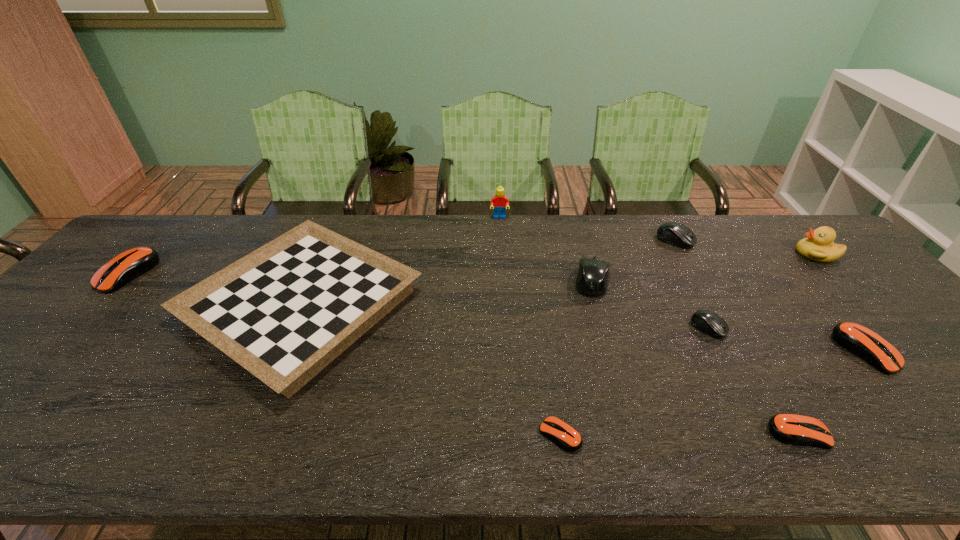
Locate an element on the screen. vacant space at the left edge of the desktop is located at coordinates (18, 408).

Find the location of a particular element. vacant space at the right edge of the desktop is located at coordinates (887, 302).

You are a GUI agent. You are given a task and a screenshot of the screen. Output one action in this format:
    pyautogui.click(x=<x>, y=<y>)
    Task: Click on the vacant space at the far right corner of the desktop
    This screenshot has width=960, height=540.
    Given the screenshot: What is the action you would take?
    pyautogui.click(x=769, y=221)

This screenshot has height=540, width=960. What are the coordinates of `empty space that is in between the shortest computer mouse and the nearest black mouse` in the screenshot? It's located at (635, 381).

Locate an element on the screen. This screenshot has height=540, width=960. unoccupied area between the farthest computer mouse and the nearest black mouse is located at coordinates (692, 284).

Identify the location of unoccupied area between the tallest computer mouse and the smallest orange computer mouse. The image size is (960, 540). (576, 357).

What are the coordinates of `free area in between the leftmost object and the ninth tallest object` in the screenshot? It's located at (463, 354).

The height and width of the screenshot is (540, 960). Identify the location of vacant area between the second biggest orange computer mouse and the farthest orange computer mouse. (496, 312).

I want to click on free spot between the second object from left to right and the second biggest orange computer mouse, so click(585, 328).

Where is `free space between the second shortest computer mouse and the smallest black mouse`? free space between the second shortest computer mouse and the smallest black mouse is located at coordinates (754, 381).